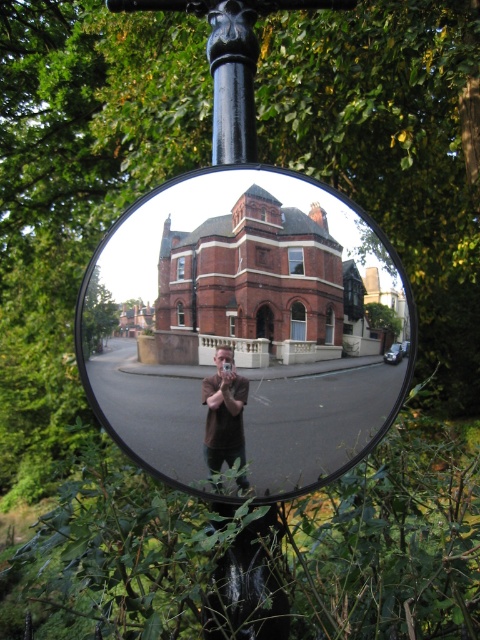
Question: Is matte glass mirror at center closer to the viewer compared to brown leather jacket at center?

Choices:
 (A) no
 (B) yes

Answer: (B)

Question: Can you confirm if matte glass mirror at center is bigger than brown leather jacket at center?

Choices:
 (A) yes
 (B) no

Answer: (A)

Question: Which object appears closest to the camera in this image?

Choices:
 (A) matte glass mirror at center
 (B) brown leather jacket at center

Answer: (A)

Question: Is matte glass mirror at center to the right of brown leather jacket at center from the viewer's perspective?

Choices:
 (A) yes
 (B) no

Answer: (A)

Question: Which of the following is the closest to the observer?

Choices:
 (A) matte glass mirror at center
 (B) brown leather jacket at center

Answer: (A)